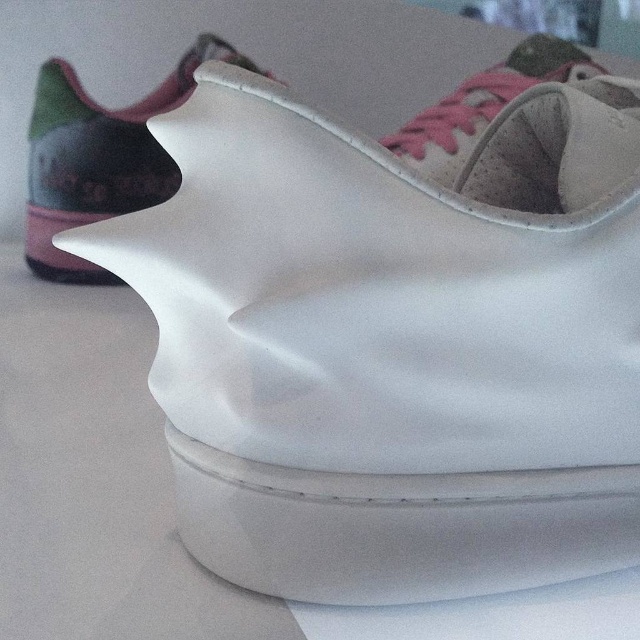
Question: Which of the following is the closest to the observer?

Choices:
 (A) (484, 124)
 (B) (102, 152)

Answer: (A)

Question: Is the position of white matte shoe at upper center less distant than that of suede pink shoe at upper center?

Choices:
 (A) no
 (B) yes

Answer: (A)

Question: Is white matte shoe at upper center closer to the viewer compared to suede pink shoe at upper center?

Choices:
 (A) yes
 (B) no

Answer: (B)

Question: Is white matte shoe at upper center further to camera compared to suede pink shoe at upper center?

Choices:
 (A) yes
 (B) no

Answer: (A)

Question: Which point appears closest to the camera in this image?

Choices:
 (A) (161, 93)
 (B) (461, 113)

Answer: (B)

Question: Which object appears farthest from the camera in this image?

Choices:
 (A) white matte shoe at upper center
 (B) suede pink shoe at upper center

Answer: (A)